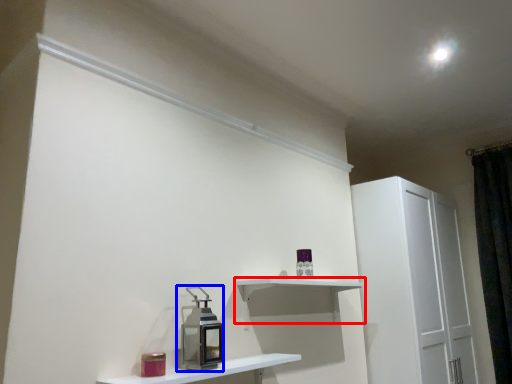
Question: Which object appears farthest to the camera in this image, shelf (highlighted by a red box) or appliance (highlighted by a blue box)?

Choices:
 (A) shelf
 (B) appliance

Answer: (A)